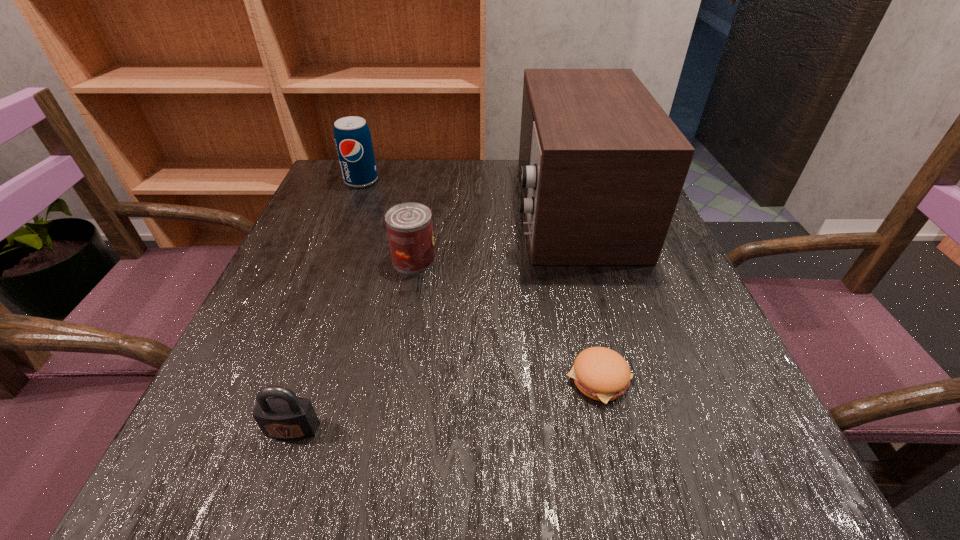
You are a GUI agent. You are given a task and a screenshot of the screen. Output one action in this format:
    pyautogui.click(x=<x>, y=<y>)
    Task: Click on the vacant space that satisfies the following two spatial constraints: 1. on the front side of the fourth shortest object; 2. on the left side of the can
    
    Given the screenshot: What is the action you would take?
    pyautogui.click(x=330, y=259)